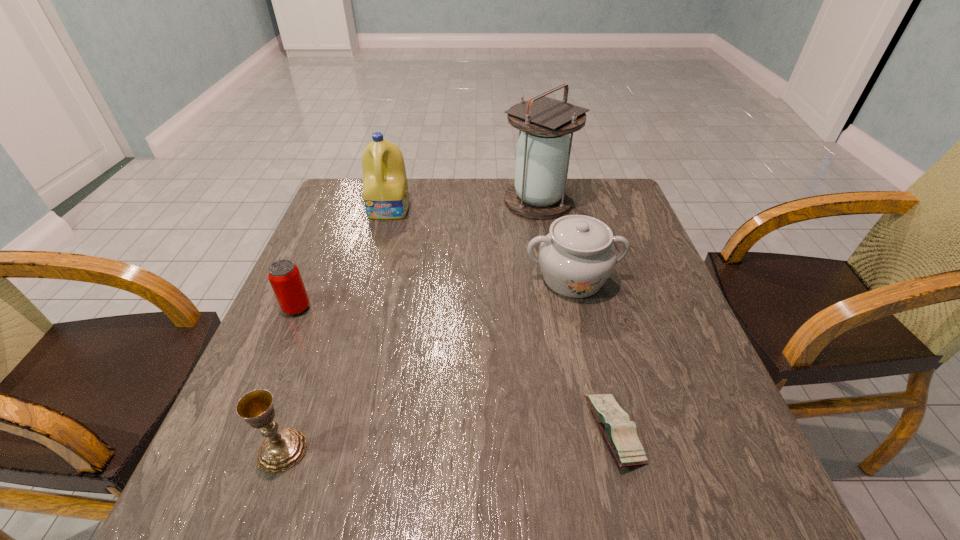
Where is `the tallest object`? The width and height of the screenshot is (960, 540). the tallest object is located at coordinates (543, 150).

The image size is (960, 540). What are the coordinates of `the fifth shortest object` in the screenshot? It's located at (385, 190).

The image size is (960, 540). Find the location of `chinaware`. chinaware is located at coordinates (576, 258).

At what (x,y) coordinates should I click in order to perform the action: click on chalice. Please return your answer as a coordinate pair (x, y). The height and width of the screenshot is (540, 960). Looking at the image, I should click on (282, 449).

Find the location of a particular element. Image resolution: width=960 pixels, height=540 pixels. the second shortest object is located at coordinates (284, 276).

Locate an element on the screen. Image resolution: width=960 pixels, height=540 pixels. can is located at coordinates (284, 276).

The height and width of the screenshot is (540, 960). Find the location of `diary`. diary is located at coordinates (620, 433).

The height and width of the screenshot is (540, 960). I want to click on free location located 0.200m on the front of the tallest object, so click(550, 268).

Identify the location of free space located on the label of the fifth shortest object. (364, 305).

Where is `vacant space situated 0.360m on the left of the chinaware`? This screenshot has width=960, height=540. vacant space situated 0.360m on the left of the chinaware is located at coordinates (378, 279).